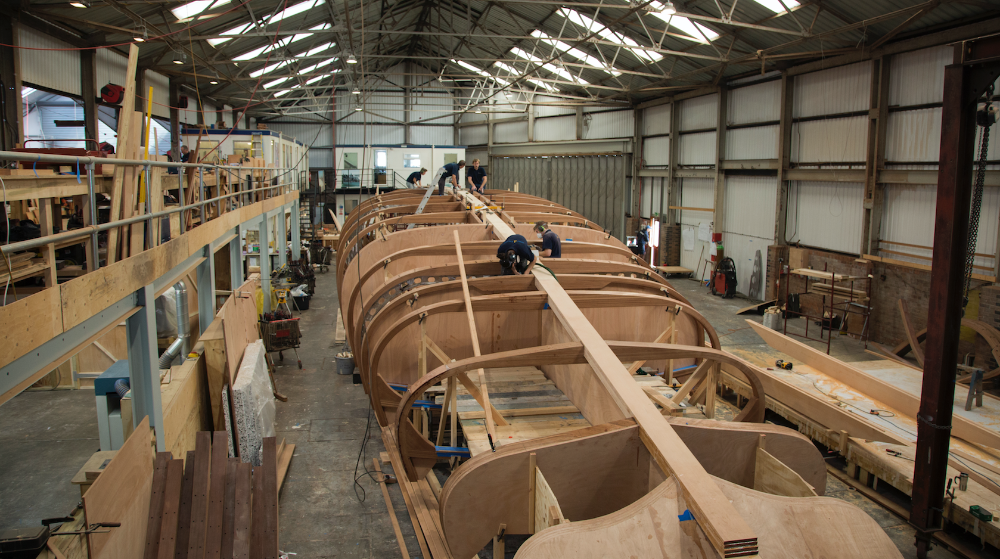
Where is `window`? window is located at coordinates (54, 137), (124, 127).